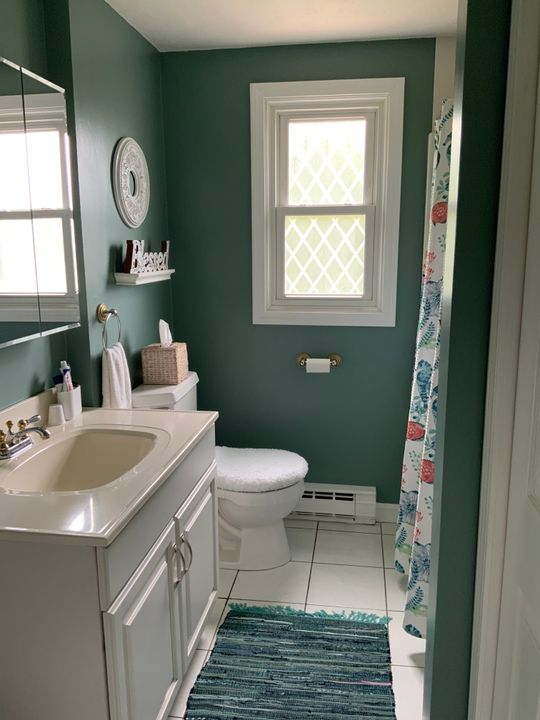
I want to click on 1 toilet, so click(260, 513).